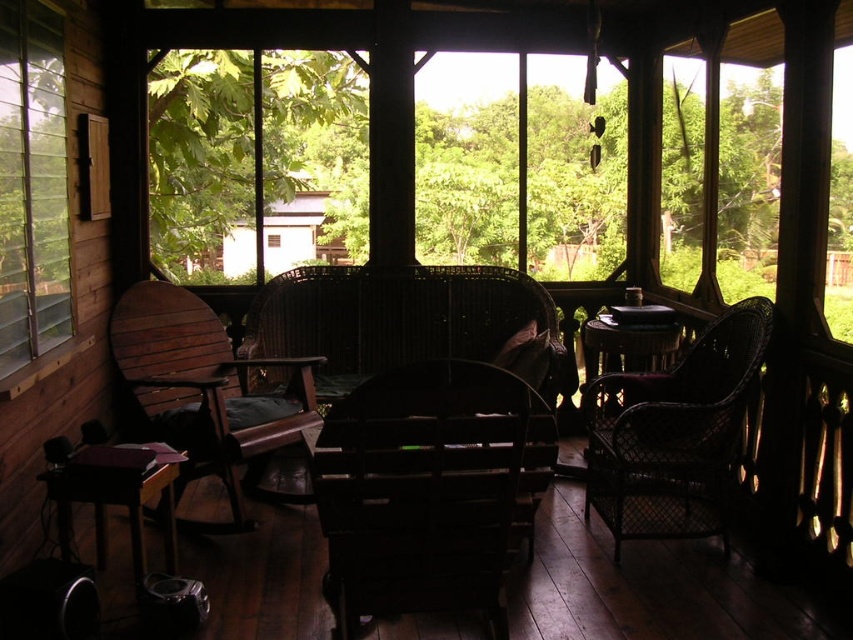
Consider the image. You are standing on the porch and want to sit down on the dark wood rocking chair at center. Which object is located at the coordinates point [650,588] that can help you find the chair?

The point [650,588] is located on the dark wood rocking chair at center, so you can use this coordinate to locate the chair.

Looking at this image, you are standing on the rustic porch and want to sit down. The dark brown wicker chair at center is your target. Can you estimate its position relative to the other objects on the porch?

The dark brown wicker chair at center is located at coordinates 0.766 on the x axis and 0.501 on the y axis, which places it near the central area of the porch.